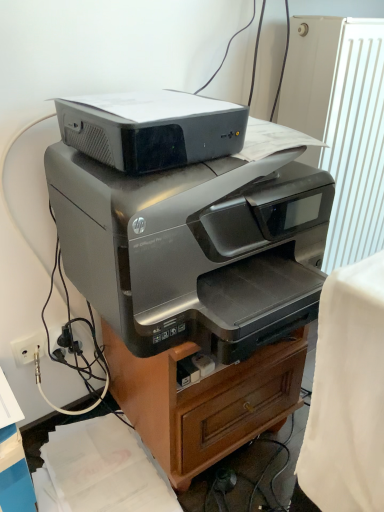
Question: Is white textured radiator at upper right outside of satin silver printer at center, which ranks as the 1th printer in bottom-to-top order?

Choices:
 (A) yes
 (B) no

Answer: (A)

Question: Considering the relative sizes of white textured radiator at upper right and satin silver printer at center, the second printer from the top, in the image provided, is white textured radiator at upper right smaller than satin silver printer at center, the second printer from the top,?

Choices:
 (A) yes
 (B) no

Answer: (B)

Question: From the image's perspective, is white textured radiator at upper right beneath satin silver printer at center, which ranks as the 1th printer in bottom-to-top order?

Choices:
 (A) yes
 (B) no

Answer: (B)

Question: From a real-world perspective, is white textured radiator at upper right positioned under satin silver printer at center, the second printer from the top, based on gravity?

Choices:
 (A) no
 (B) yes

Answer: (B)

Question: Are white textured radiator at upper right and satin silver printer at center, which ranks as the 1th printer in bottom-to-top order, making contact?

Choices:
 (A) no
 (B) yes

Answer: (A)

Question: In terms of height, does white plastic electric outlet at lower left look taller or shorter compared to matte black printer at upper center, arranged as the 1th printer when viewed from the top?

Choices:
 (A) tall
 (B) short

Answer: (B)

Question: Relative to matte black printer at upper center, arranged as the 1th printer when viewed from the top, is white plastic electric outlet at lower left in front or behind?

Choices:
 (A) front
 (B) behind

Answer: (B)

Question: Which is correct: white plastic electric outlet at lower left is inside matte black printer at upper center, arranged as the 1th printer when viewed from the top, or outside of it?

Choices:
 (A) inside
 (B) outside

Answer: (B)

Question: From the image's perspective, is white plastic electric outlet at lower left positioned above or below matte black printer at upper center, which appears as the second printer when ordered from the bottom?

Choices:
 (A) above
 (B) below

Answer: (B)

Question: From a real-world perspective, is satin silver printer at center above or below satin silver printer at center, the second printer from the top?

Choices:
 (A) below
 (B) above

Answer: (A)

Question: Is satin silver printer at center inside the boundaries of satin silver printer at center, which ranks as the 1th printer in bottom-to-top order, or outside?

Choices:
 (A) outside
 (B) inside

Answer: (A)

Question: From the image's perspective, is satin silver printer at center above or below satin silver printer at center, which ranks as the 1th printer in bottom-to-top order?

Choices:
 (A) below
 (B) above

Answer: (A)

Question: Is satin silver printer at center to the left or to the right of satin silver printer at center, the second printer from the top, in the image?

Choices:
 (A) left
 (B) right

Answer: (B)

Question: From the image's perspective, relative to white textured radiator at upper right, is satin silver printer at center, which ranks as the 1th printer in bottom-to-top order, above or below?

Choices:
 (A) below
 (B) above

Answer: (A)

Question: From a real-world perspective, is satin silver printer at center, the second printer from the top, positioned above or below white textured radiator at upper right?

Choices:
 (A) below
 (B) above

Answer: (B)